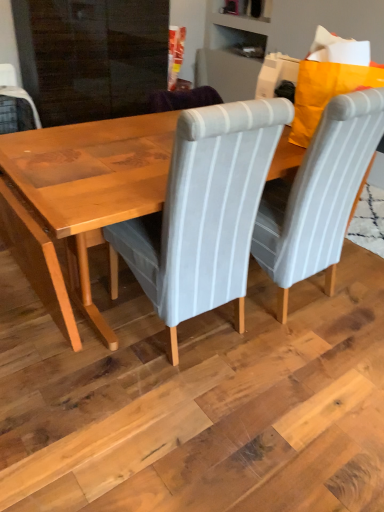
You are a GUI agent. You are given a task and a screenshot of the screen. Output one action in this format:
    pyautogui.click(x=<x>, y=<y>)
    Task: Click on the free space to the left of light gray fabric chair at center, the 1th chair positioned from the left
    Image resolution: width=384 pixels, height=512 pixels.
    Given the screenshot: What is the action you would take?
    pyautogui.click(x=73, y=322)